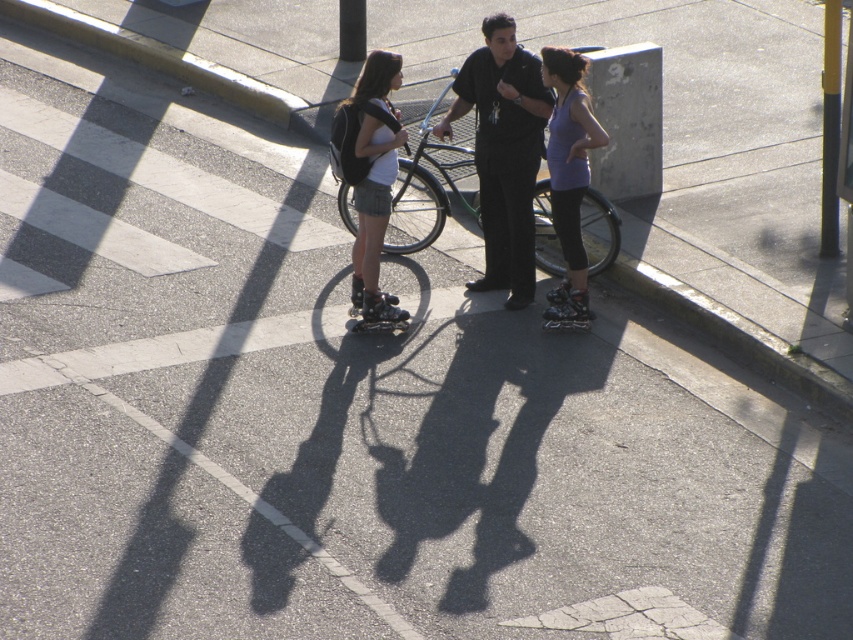
Question: Can you confirm if matte black roller skates at center is bigger than purple matte tank top at center?

Choices:
 (A) no
 (B) yes

Answer: (A)

Question: Which point is farther from the camera taking this photo?

Choices:
 (A) (573, 60)
 (B) (515, 115)
 (C) (399, 176)
 (D) (383, 51)

Answer: (C)

Question: Does silver metallic bicycle at center come behind matte black roller skates at center?

Choices:
 (A) yes
 (B) no

Answer: (A)

Question: Which of the following is the farthest from the observer?

Choices:
 (A) silver metallic bicycle at center
 (B) black smooth shirt at center

Answer: (A)

Question: Is black smooth shirt at center above silver metallic bicycle at center?

Choices:
 (A) yes
 (B) no

Answer: (A)

Question: Which of the following is the closest to the observer?

Choices:
 (A) (589, 205)
 (B) (358, 300)

Answer: (B)